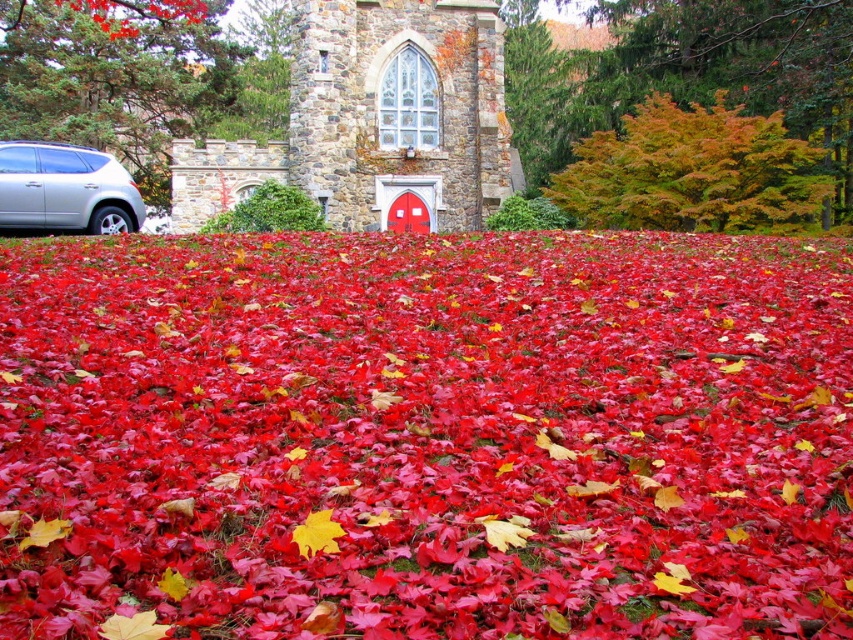
You are standing at the point closest to the red door in the autumn scene. Which of the two points, point (795, 608) or point (258, 97), is closer to you?

Point (795, 608) is in front of point (258, 97), so it is closer to you.

You are standing in the autumn scene and want to take a photo of both the shiny red leaves at center and the green leafy tree at left. Since you only have a wide angle lens, which object should you position closer to the center of your camera frame to include both in the shot?

Since the shiny red leaves at center is to the right of green leafy tree at left, you should position the green leafy tree at left closer to the center of your camera frame to include both in the shot.

Based on the photo, you are standing in an autumn scene with a stone building in the background. You notice a point marked at coordinates (426, 435). What is located at that point?

The point at (426, 435) marks shiny red leaves at the center of the scene.